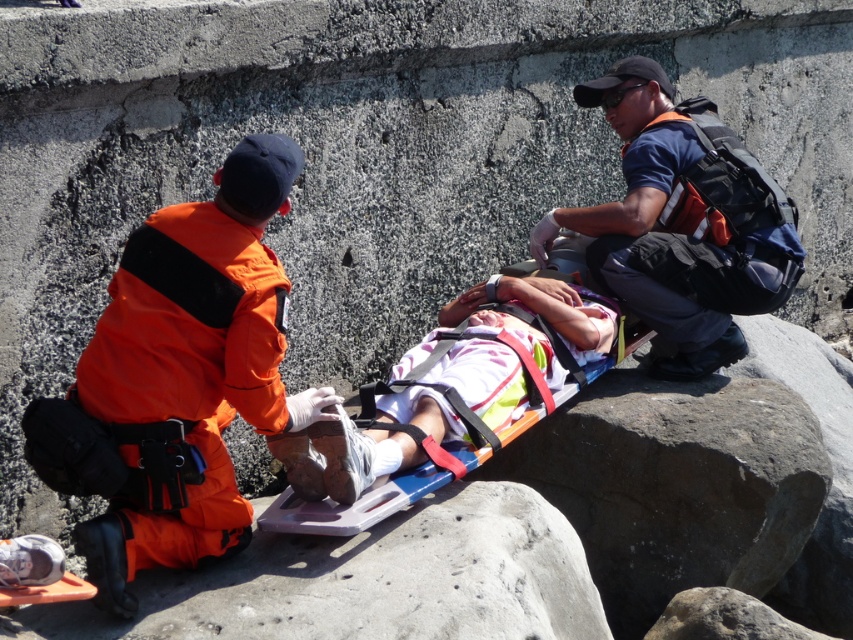
You are a drone operator trying to capture a closeup of the injured person on the stretcher. The two points you need to focus on are point (x=692, y=308) and point (x=399, y=484). Which point should you focus on to get a closer shot of the injured person?

Point (x=692, y=308) is further to the camera than point (x=399, y=484), so focusing on point (x=399, y=484) would allow for a closer shot of the injured person.

Based on the photo, you are a bystander observing the rescue operation. You notice the orange fabric uniform at left and the blue fabric backpack at upper right. Which object is shorter in height?

The orange fabric uniform at left is shorter in height than the blue fabric backpack at upper right.